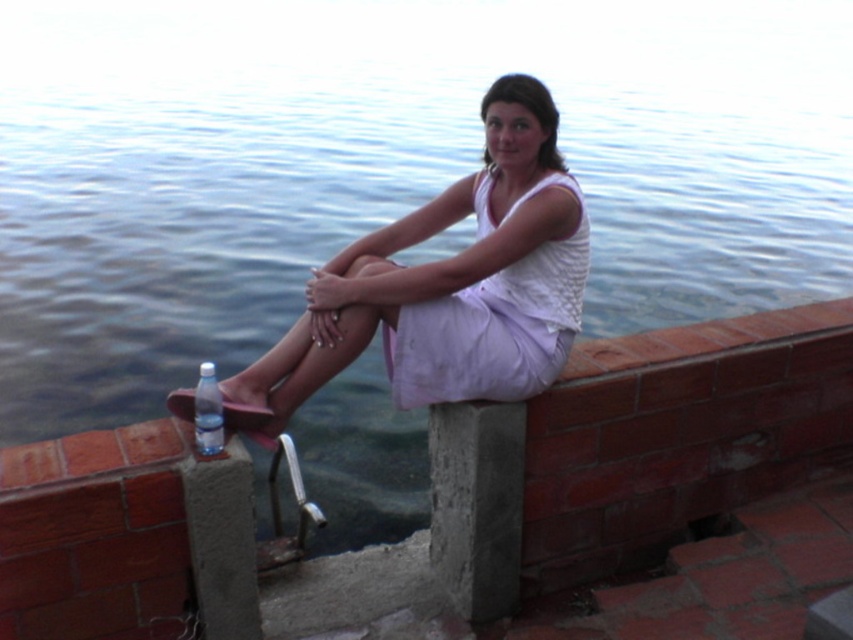
You are a photographer who wants to capture the white cotton dress at center and the clear plastic bottle at lower left in the same frame. Based on their positions, which object should you adjust your camera to focus on first if you want to include both in your shot?

Since the white cotton dress at center is to the right of the clear plastic bottle at lower left, you should focus on the clear plastic bottle at lower left first to ensure both objects are within the frame.

You are a photographer standing in front of the scene. You want to take a photo focusing on the white cotton dress at center and the clear plastic bottle at lower left. Which object will appear closer to the camera in the photo?

The white cotton dress at center will appear closer to the camera because it is further to the viewer than the clear plastic bottle at lower left.

Consider the image. You are a fashion designer observing two dresses in an image. The scene shows a woman sitting on a concrete block on a brick wall near a water source. You notice the white matte dress at center and the white cotton dress at center. Which dress is taller?

The white matte dress at center is taller than the white cotton dress at center.